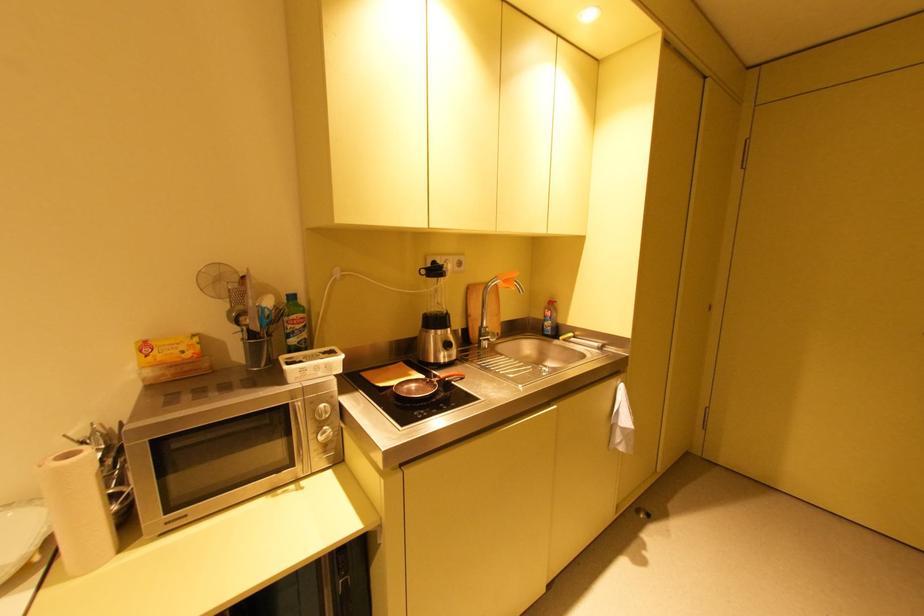
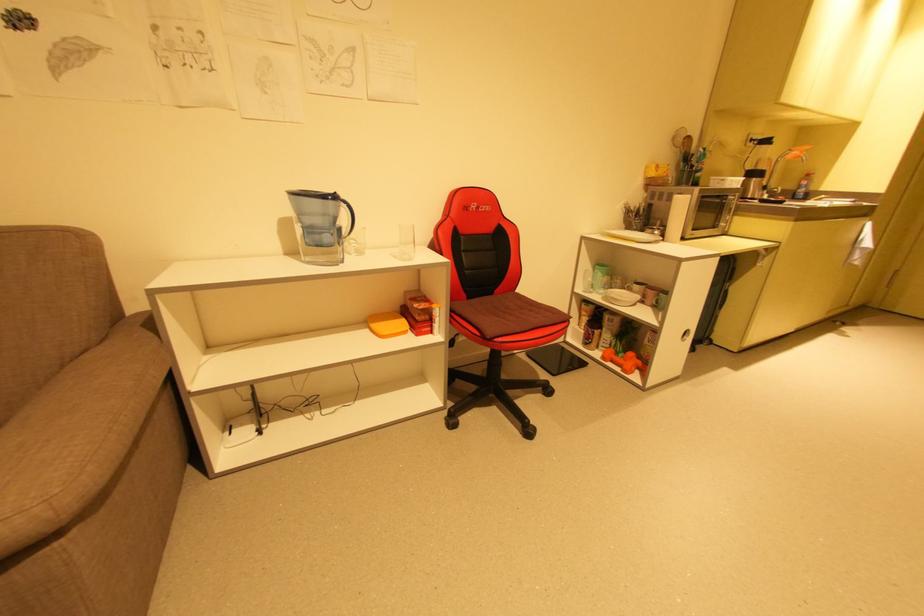
Where in the second image is the point corresponding to [508,282] from the first image?

(805, 152)